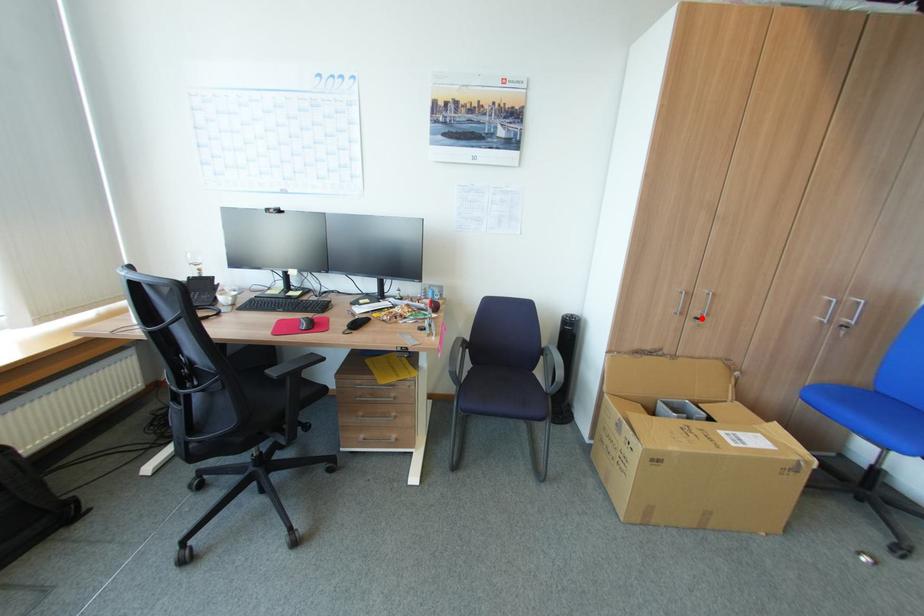
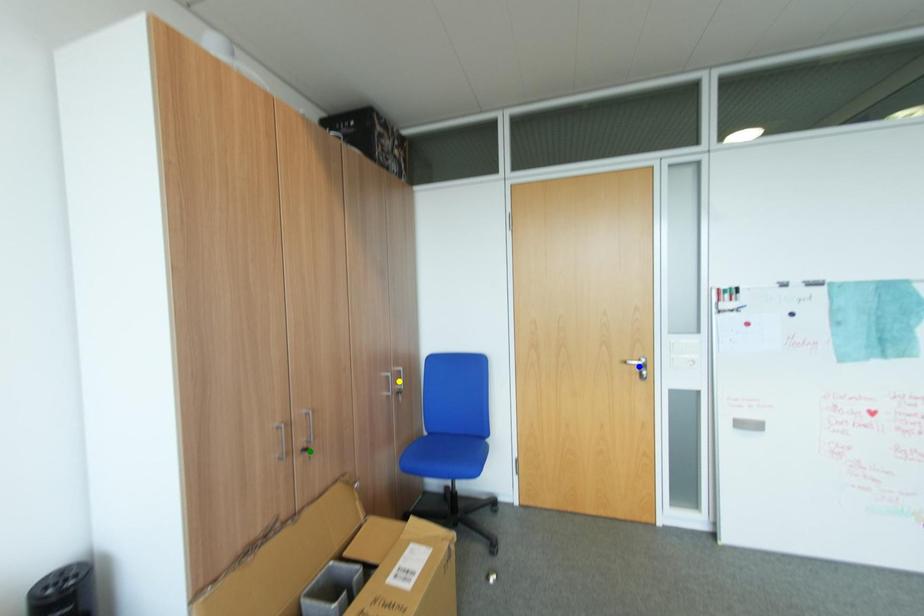
Question: I am providing you with two images of the same scene from different viewpoints. A red point is marked on the first image. You are given multiple points on the second image. Can you choose the point in image 2 that corresponds to the point in image 1?

Choices:
 (A) yellow point
 (B) blue point
 (C) green point

Answer: (C)